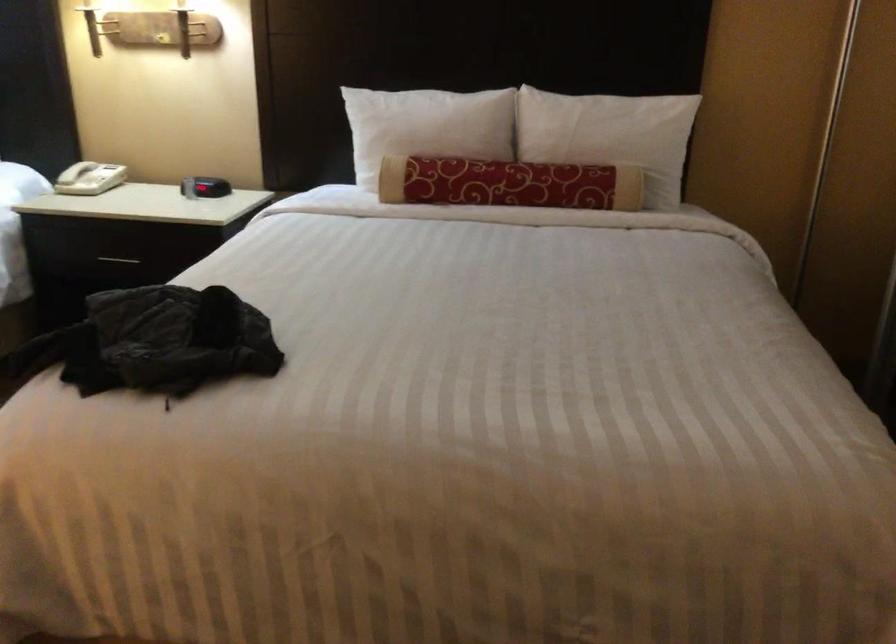
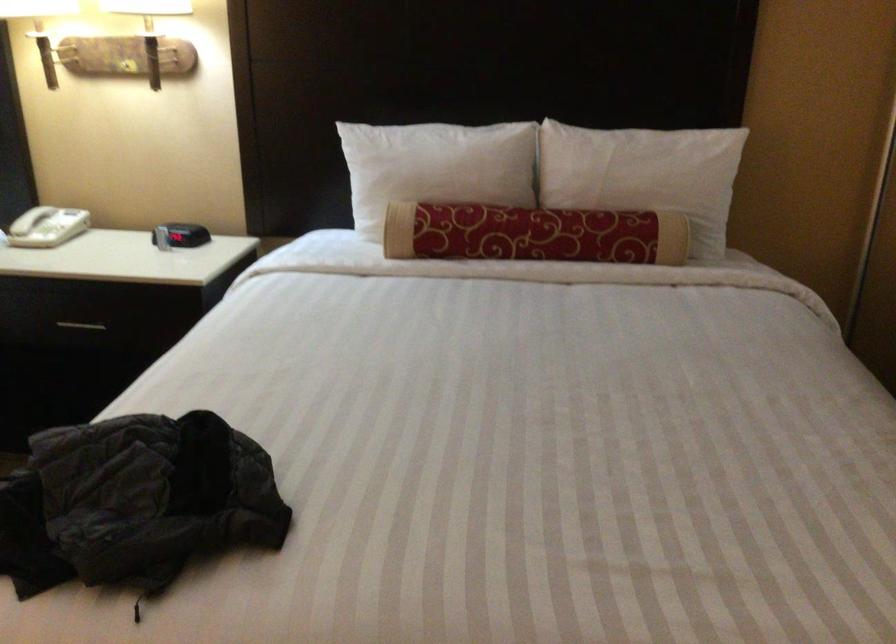
The point at (75, 167) is marked in the first image. Where is the corresponding point in the second image?

(30, 220)